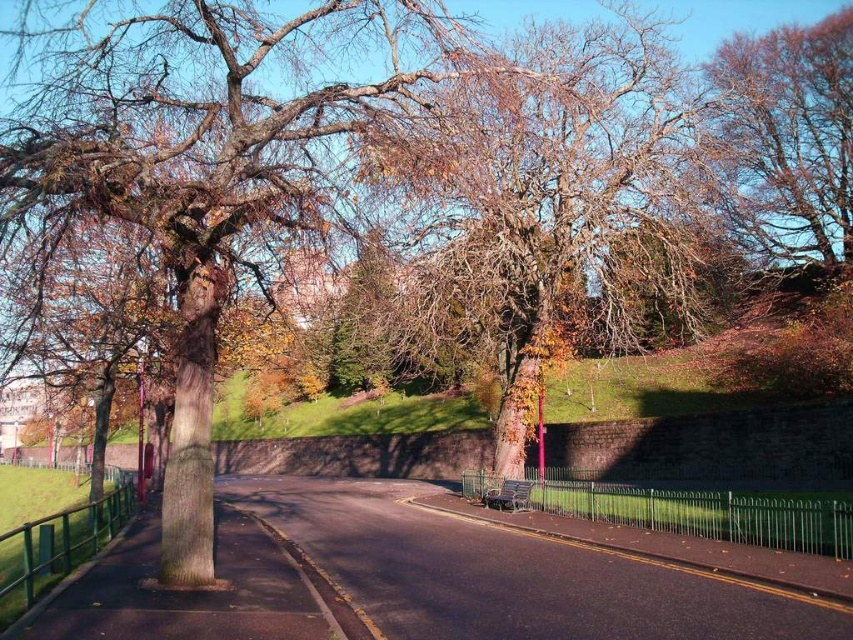
You are a park visitor standing on the paved road in the foreground. You want to walk to the brown textured tree at upper right. Which direction should you turn to reach it from the brown rough bark tree at left?

You should turn to the right to reach the brown textured tree at upper right from the brown rough bark tree at left because the brown rough bark tree at left is located to the left of the brown textured tree at upper right.

You are a park visitor standing on the paved road and looking towards the green metal fence. You see both the brown rough bark tree at left and the brown rough bark tree at center. Which tree appears closer to you?

The brown rough bark tree at left appears closer because it is positioned above the brown rough bark tree at center, indicating it is nearer in the visual plane.

You are a park visitor standing on the paved road. You see the brown rough bark tree at center and the brown textured tree at upper right. Which tree would cast a longer shadow at noon?

The brown rough bark tree at center is taller than the brown textured tree at upper right, so it would cast a longer shadow at noon.